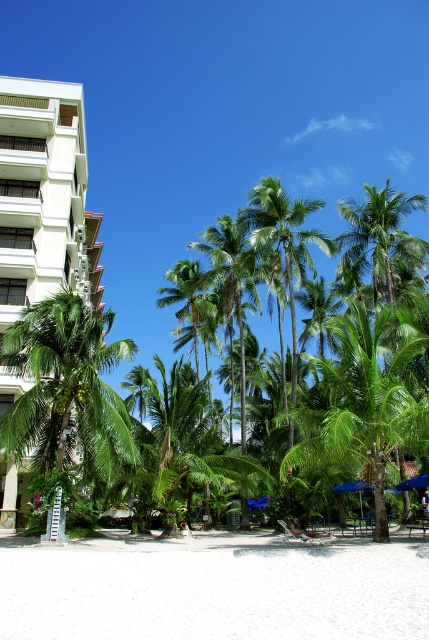
Question: Which object is closer to the camera taking this photo?

Choices:
 (A) green leafy palm tree at left
 (B) white plastic beach chair at center
 (C) white sand beach at lower center

Answer: (C)

Question: Does white plastic beach chair at center have a greater width compared to blue fabric umbrella at center?

Choices:
 (A) yes
 (B) no

Answer: (B)

Question: Which object is positioned closest to the white plastic beach chair at center?

Choices:
 (A) white smooth building at upper left
 (B) blue fabric umbrella at center
 (C) white sand beach at lower center
 (D) green leafy palm tree at left

Answer: (B)

Question: Which of the following is the farthest from the observer?

Choices:
 (A) white sand beach at lower center
 (B) white plastic beach chair at center

Answer: (B)

Question: Can you confirm if green leafy palm tree at left is positioned above blue fabric umbrella at center?

Choices:
 (A) yes
 (B) no

Answer: (A)

Question: Is white smooth building at upper left bigger than white plastic beach chair at center?

Choices:
 (A) yes
 (B) no

Answer: (A)